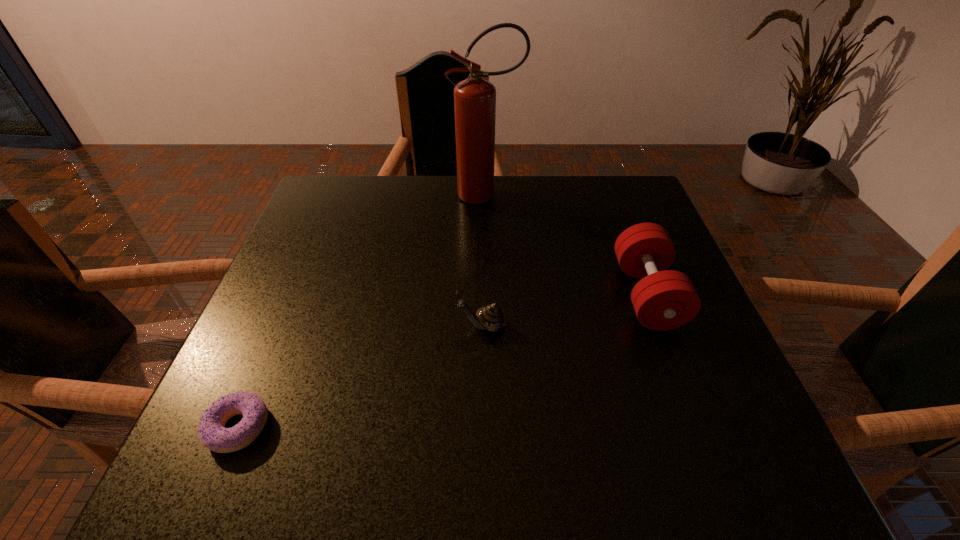
You are a GUI agent. You are given a task and a screenshot of the screen. Output one action in this format:
    pyautogui.click(x=<x>, y=<y>)
    Task: Click on the farthest object
    This screenshot has width=960, height=540.
    Given the screenshot: What is the action you would take?
    pyautogui.click(x=474, y=98)

Find the location of a particular element. The height and width of the screenshot is (540, 960). fire extinguisher is located at coordinates (474, 98).

Locate an element on the screen. the rightmost object is located at coordinates (664, 299).

Where is `snail`? This screenshot has height=540, width=960. snail is located at coordinates (491, 318).

Locate an element on the screen. The image size is (960, 540). the shortest object is located at coordinates (212, 432).

Find the location of `the leftmost object`. the leftmost object is located at coordinates (212, 432).

Locate an element on the screen. vacant space situated from the nozzle of the tallest object is located at coordinates (332, 195).

Locate an element on the screen. This screenshot has height=540, width=960. free space located 0.200m from the nozzle of the tallest object is located at coordinates (378, 195).

This screenshot has height=540, width=960. I want to click on vacant space situated 0.130m from the nozzle of the tallest object, so click(404, 195).

The width and height of the screenshot is (960, 540). What are the coordinates of `free space located on the left of the dumbbell` in the screenshot? It's located at (490, 294).